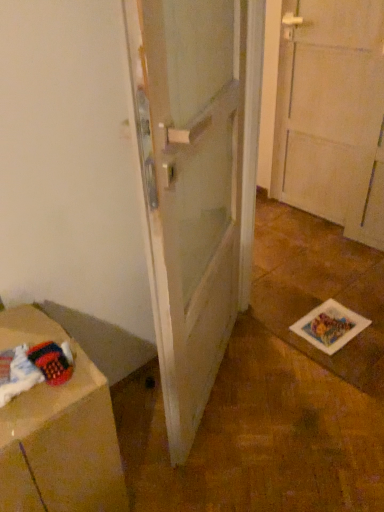
Question: From a real-world perspective, is white matte door at center above or below brown cardboard at lower left?

Choices:
 (A) above
 (B) below

Answer: (A)

Question: From the image's perspective, is white matte door at center above or below brown cardboard at lower left?

Choices:
 (A) below
 (B) above

Answer: (B)

Question: Is white matte door at center bigger or smaller than brown cardboard at lower left?

Choices:
 (A) big
 (B) small

Answer: (A)

Question: Is brown cardboard at lower left bigger or smaller than white matte door at center?

Choices:
 (A) big
 (B) small

Answer: (B)

Question: Considering the positions of brown cardboard at lower left and white matte door at center in the image, is brown cardboard at lower left taller or shorter than white matte door at center?

Choices:
 (A) short
 (B) tall

Answer: (A)

Question: In the image, is brown cardboard at lower left positioned in front of or behind white matte door at center?

Choices:
 (A) behind
 (B) front

Answer: (A)

Question: From a real-world perspective, is brown cardboard at lower left positioned above or below white matte door at center?

Choices:
 (A) below
 (B) above

Answer: (A)